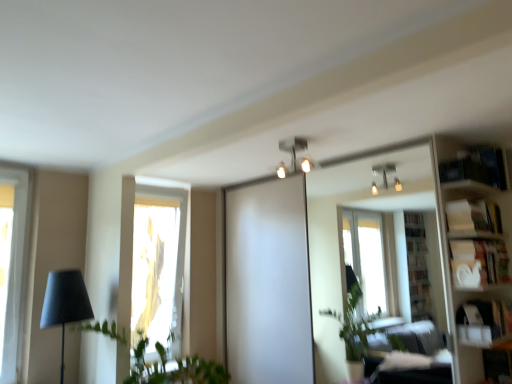
Question: Choose the correct answer: Is white glossy bookshelf at right inside white matte bookshelf at right, which ranks as the 1th shelf in bottom-to-top order, or outside it?

Choices:
 (A) outside
 (B) inside

Answer: (A)

Question: In terms of height, does white glossy bookshelf at right look taller or shorter compared to white matte bookshelf at right, the third shelf in the top-to-bottom sequence?

Choices:
 (A) tall
 (B) short

Answer: (A)

Question: Which object is positioned closest to the white cardboard box at upper right, acting as the second shelf starting from the top?

Choices:
 (A) white glossy bookshelf at right
 (B) green leafy plant at left
 (C) clear glass mirror at upper center
 (D) blue cardboard bookshelf at upper right, the first shelf from the top
 (E) metallic silver light fixture at upper center

Answer: (D)

Question: Which is farther from the matte black lamp at left?

Choices:
 (A) blue cardboard bookshelf at upper right, the third shelf positioned from the bottom
 (B) metallic silver light fixture at upper center
 (C) white matte bookshelf at right, which ranks as the 1th shelf in bottom-to-top order
 (D) white cardboard box at upper right, positioned as the second shelf in bottom-to-top order
 (E) clear glass mirror at upper center

Answer: (A)